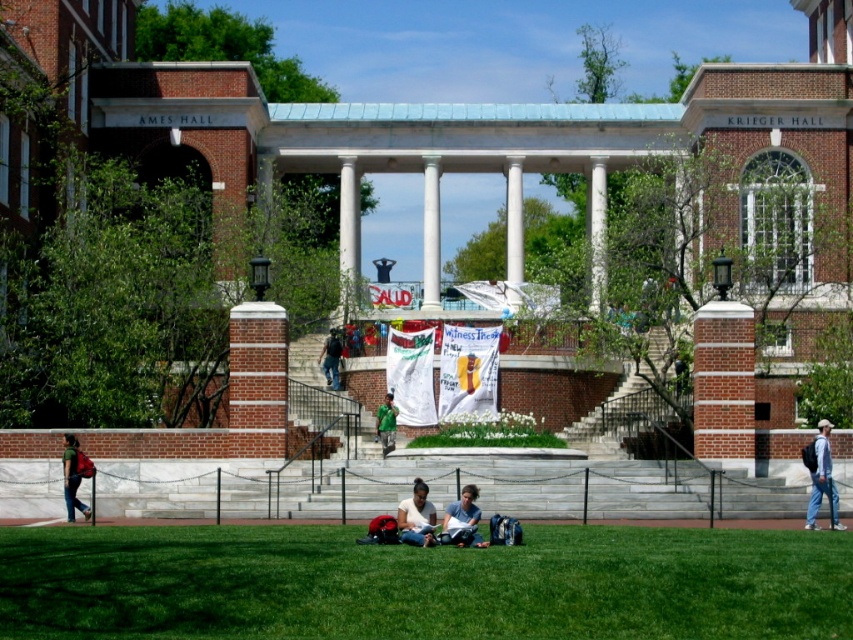
Question: Which is nearer to the matte black backpack at lower center?

Choices:
 (A) matte blue jeans at center
 (B) dark blue jeans at center

Answer: (A)

Question: Among these objects, which one is farthest from the camera?

Choices:
 (A) green fabric jacket at center
 (B) green grass at lower center
 (C) matte red backpack at lower left
 (D) dark blue jeans at center

Answer: (D)

Question: Can you confirm if blue jeans at lower right is bigger than green fabric jacket at center?

Choices:
 (A) yes
 (B) no

Answer: (A)

Question: Which of the following is the farthest from the observer?

Choices:
 (A) matte black backpack at lower center
 (B) green grass at lower center
 (C) blue jeans at lower right
 (D) dark blue jeans at center

Answer: (D)

Question: Can you confirm if blue jeans at lower right is wider than matte red backpack at lower left?

Choices:
 (A) yes
 (B) no

Answer: (A)

Question: From the image, what is the correct spatial relationship of matte blue jeans at center in relation to matte red backpack at lower left?

Choices:
 (A) right
 (B) left

Answer: (A)